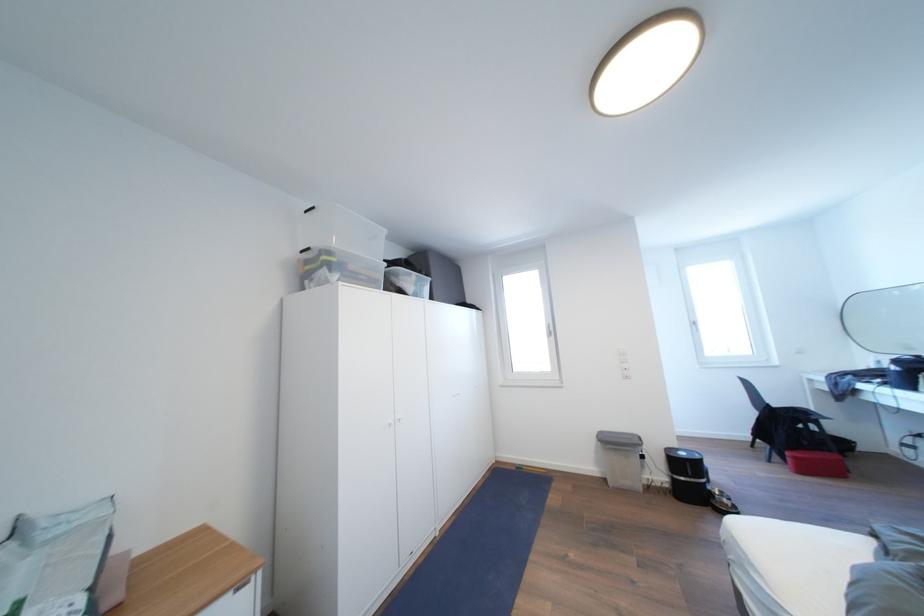
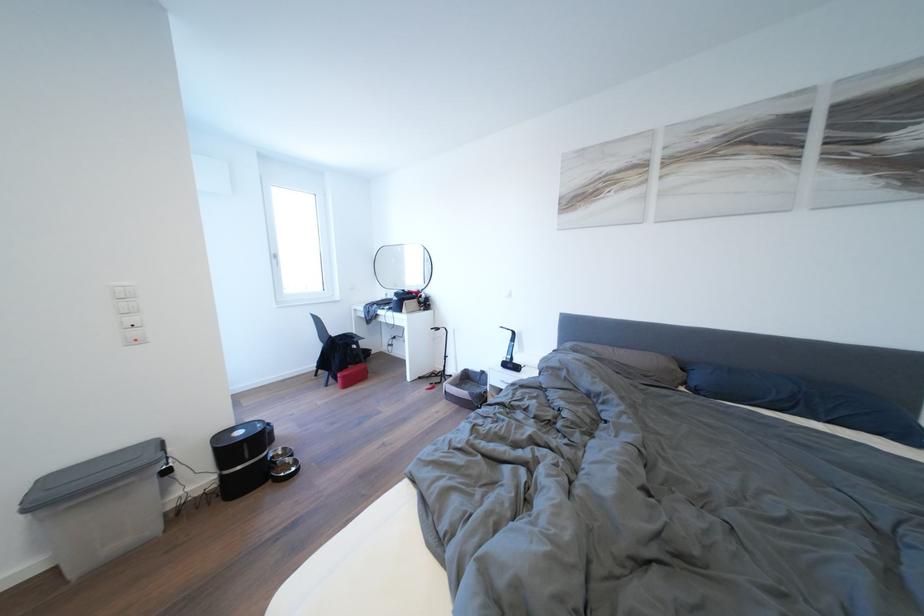
Find the pixel in the second image that matches point (796, 454) in the first image.

(348, 376)